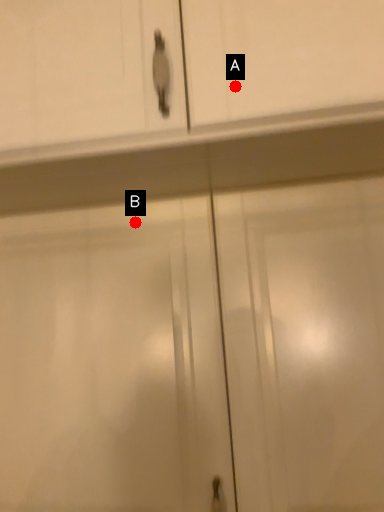
Question: Two points are circled on the image, labeled by A and B beside each circle. Which of the following is the farthest from the observer?

Choices:
 (A) A is further
 (B) B is further

Answer: (B)